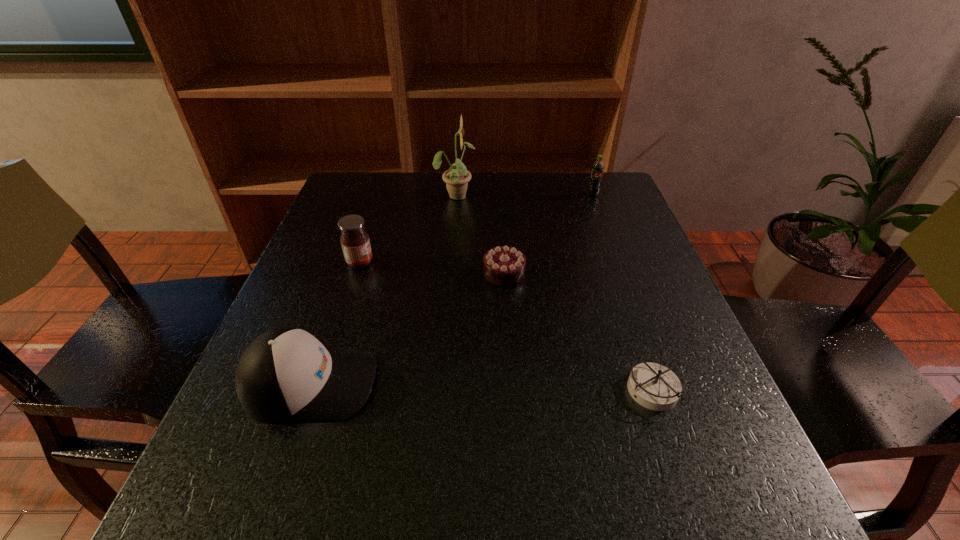
Find the location of a particular element. This screenshot has height=540, width=960. vacant area that lies between the compass and the sunflower is located at coordinates (555, 293).

Where is `free space between the third object from left to right and the cap`? free space between the third object from left to right and the cap is located at coordinates (383, 289).

In order to click on vacant region between the jam and the chocolate cake in this screenshot , I will do `click(432, 268)`.

This screenshot has width=960, height=540. Find the location of `vacant region between the soda and the jam`. vacant region between the soda and the jam is located at coordinates (476, 228).

This screenshot has height=540, width=960. Identify the location of free spot between the cap and the soda. (452, 289).

The width and height of the screenshot is (960, 540). I want to click on the fifth closest object to the soda, so click(286, 374).

I want to click on object that is the closest to the soda, so click(x=457, y=177).

Where is `vacant space that satisfies the following two spatial constraints: 1. on the front panel of the compass; 2. on the right side of the cap`? The height and width of the screenshot is (540, 960). vacant space that satisfies the following two spatial constraints: 1. on the front panel of the compass; 2. on the right side of the cap is located at coordinates (307, 391).

Where is `vacant area that satisfies the following two spatial constraints: 1. on the front side of the chocolate cake; 2. on the right side of the compass`? The width and height of the screenshot is (960, 540). vacant area that satisfies the following two spatial constraints: 1. on the front side of the chocolate cake; 2. on the right side of the compass is located at coordinates (511, 391).

Locate an element on the screen. The width and height of the screenshot is (960, 540). free space that satisfies the following two spatial constraints: 1. on the front label of the soda; 2. on the label side of the jam is located at coordinates (619, 263).